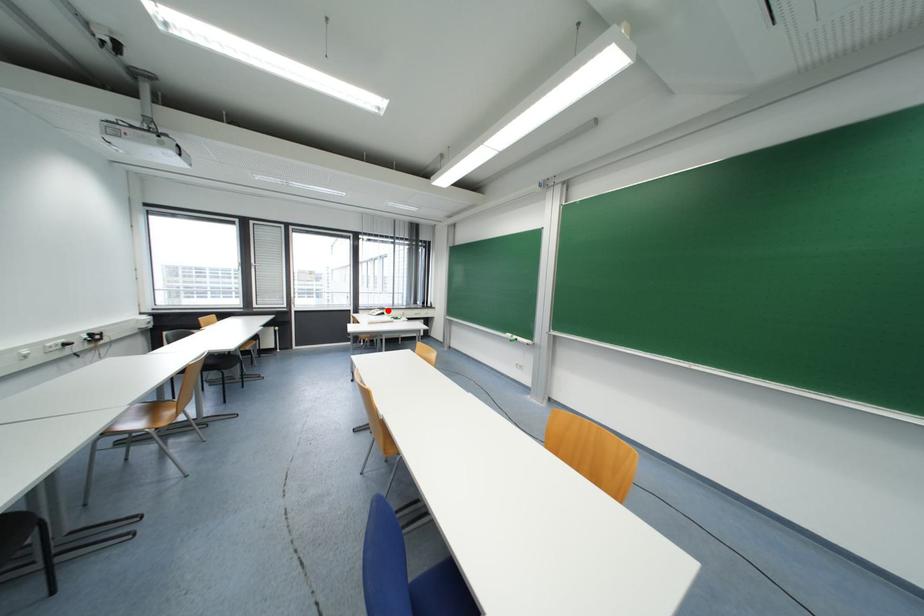
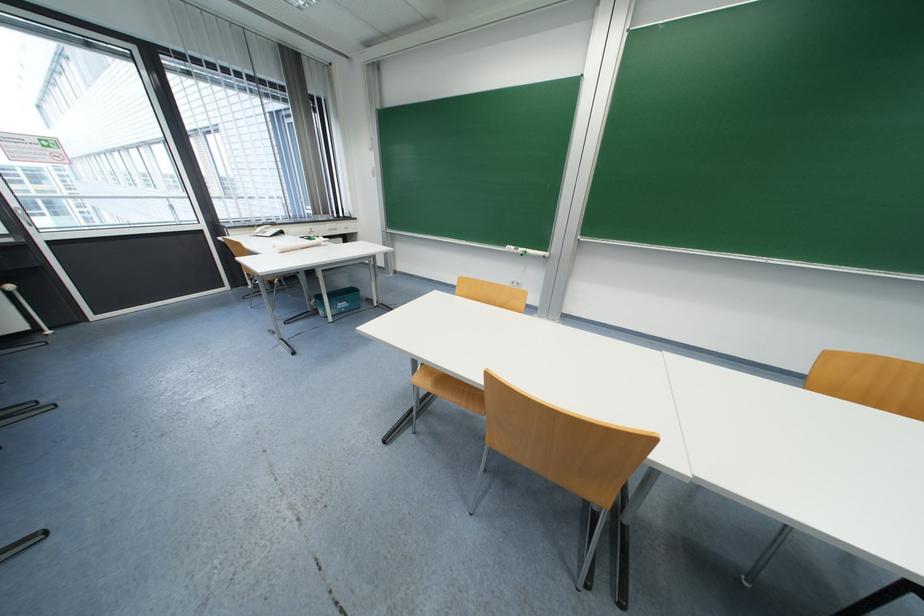
Locate, in the second image, the point that corresponds to the highlighted location in the first image.

(277, 225)